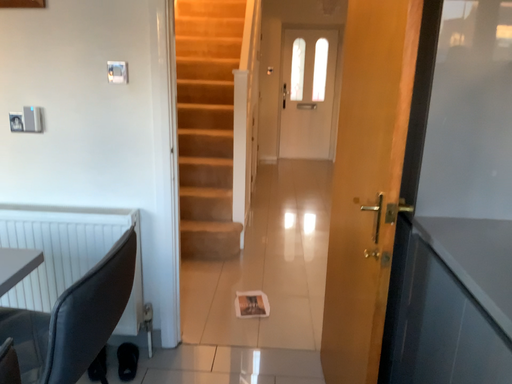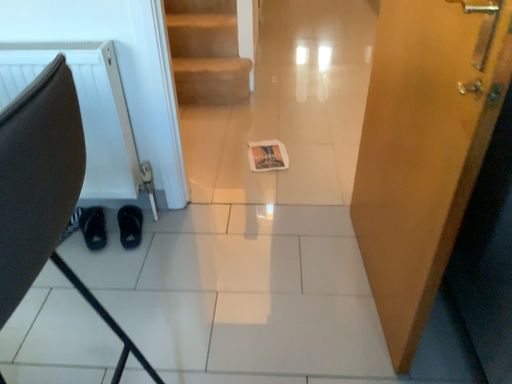
Question: How did the camera likely rotate when shooting the video?

Choices:
 (A) rotated downward
 (B) rotated upward

Answer: (A)